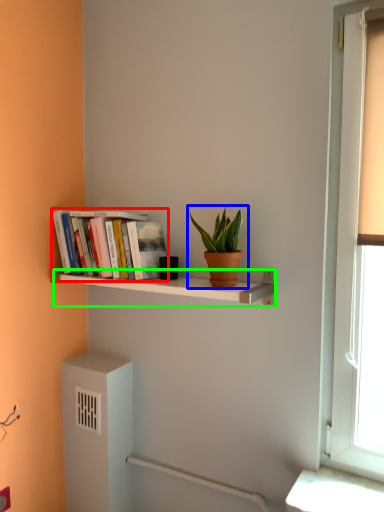
Question: Which object is the closest to the book (highlighted by a red box)? Choose among these: houseplant (highlighted by a blue box) or shelf (highlighted by a green box).

Choices:
 (A) houseplant
 (B) shelf

Answer: (B)